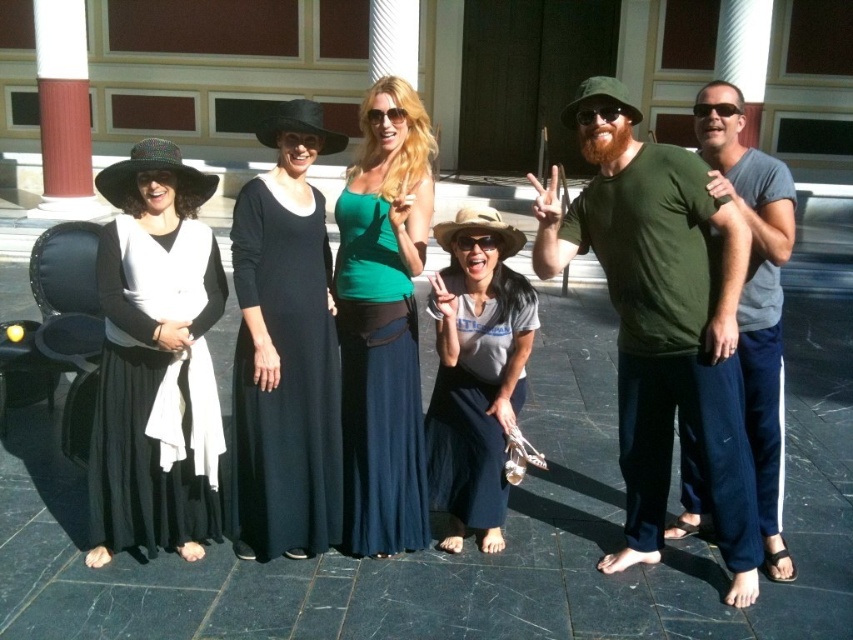
Question: Can you confirm if black matte dress at left is bigger than black cotton dress at center?

Choices:
 (A) no
 (B) yes

Answer: (B)

Question: Which object appears closest to the camera in this image?

Choices:
 (A) matte green t-shirt at center
 (B) black cotton dress at center
 (C) green matte t-shirt at center

Answer: (C)

Question: Does black cotton dress at center have a greater width compared to matte green t-shirt at center?

Choices:
 (A) no
 (B) yes

Answer: (A)

Question: Based on their relative distances, which object is farther from the green matte t-shirt at center?

Choices:
 (A) black cotton dress at center
 (B) gray cotton t-shirt at center

Answer: (A)

Question: Among these objects, which one is nearest to the camera?

Choices:
 (A) black matte dress at left
 (B) green matte tank top at center
 (C) matte green t-shirt at center
 (D) gray cotton t-shirt at center

Answer: (C)

Question: Is green matte tank top at center to the right of black cotton dress at center from the viewer's perspective?

Choices:
 (A) no
 (B) yes

Answer: (B)